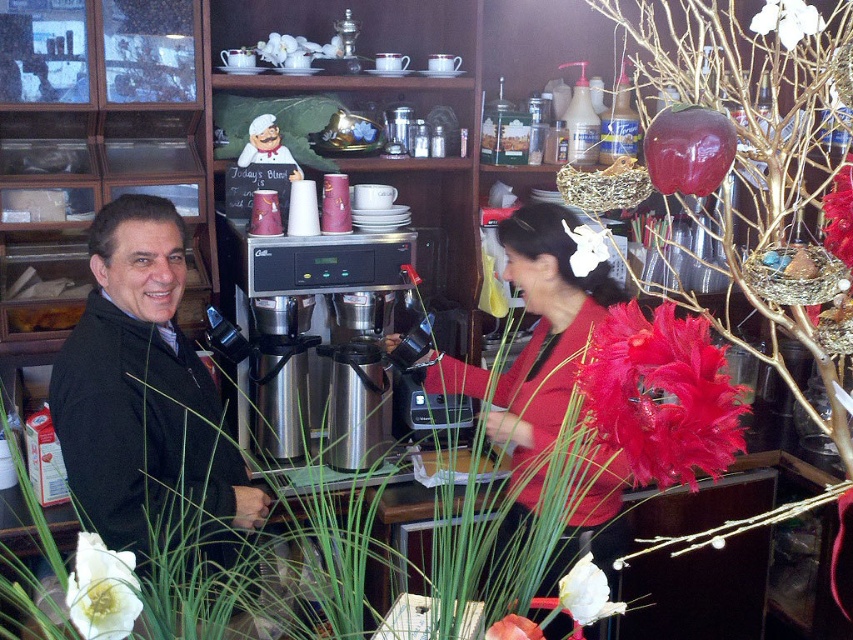
You are a barista who needs to reach the stainless steel coffee machine at center to prepare a customer order. However, there is a customer wearing a matte red sweater at center in the way. Can you easily access the coffee machine without moving the customer?

The matte red sweater at center is closer to the viewer than the stainless steel coffee machine at center, so the customer is blocking the path to the coffee machine. You would need to ask them to move or find an alternative route.

You are a customer in the cafe and want to place a small item on the table between the black matte jacket at left and the white matte flower at lower left. The item is 12 inches long. Will it fit without hanging off the table?

The distance between the black matte jacket at left and the white matte flower at lower left is 34.69 inches. Since the item is only 12 inches long, it will fit comfortably on the table without hanging off.